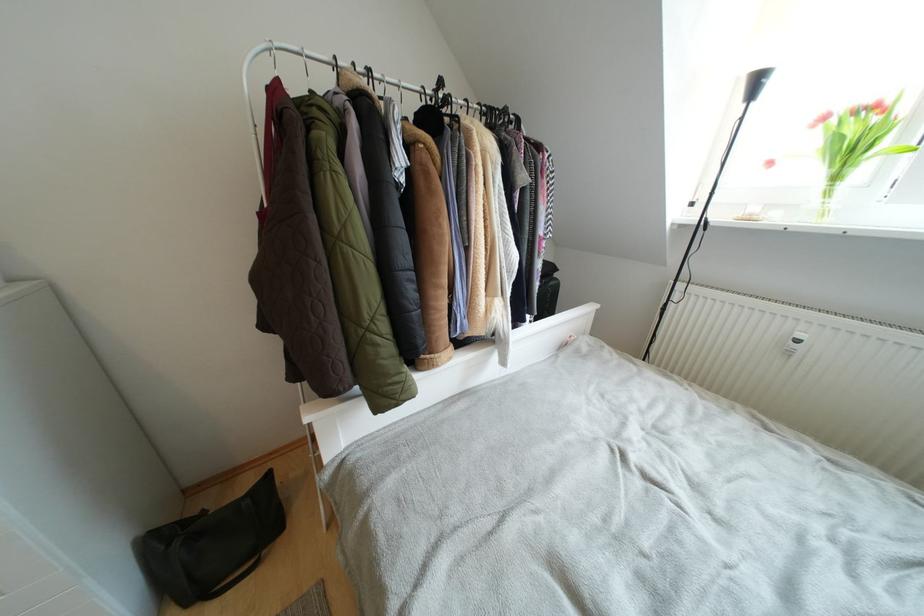
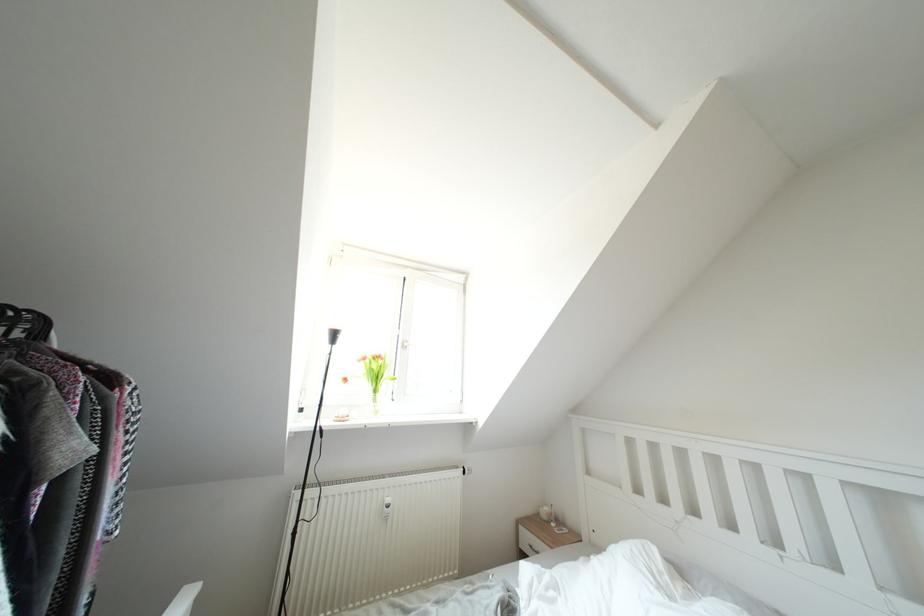
How did the camera likely rotate?

The rotation direction of the camera is right-up.